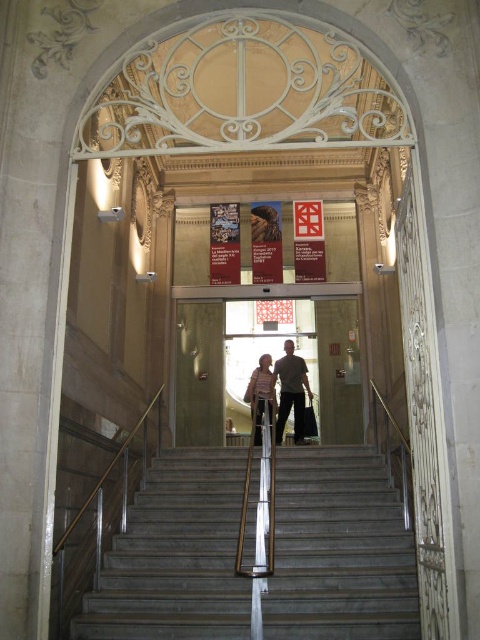
Who is more forward, (302,531) or (274,400)?

Point (302,531) is in front.

Does smooth gray stairs at center appear over matte beige dress at center?

No.

Is point (72, 627) positioned behind point (263, 403)?

No, (72, 627) is in front of (263, 403).

Where is `smooth gray stairs at center`? The width and height of the screenshot is (480, 640). smooth gray stairs at center is located at coordinates (275, 554).

Is wooden door at center to the right of light brown leather shoes at center from the viewer's perspective?

Indeed, wooden door at center is positioned on the right side of light brown leather shoes at center.

Between point (199, 339) and point (296, 440), which one is positioned in front?

Positioned in front is point (296, 440).

Locate an element on the screen. The image size is (480, 640). wooden door at center is located at coordinates (271, 355).

Is smooth gray stairs at center further to the viewer compared to wooden door at center?

That is False.

Between point (256, 588) and point (196, 324), which one is positioned behind?

Point (196, 324)

Does point (384, 593) come farther from viewer compared to point (201, 413)?

No.

At what (x,y) coordinates should I click in order to perform the action: click on smooth gray stairs at center. Please return your answer as a coordinate pair (x, y). Looking at the image, I should click on (275, 554).